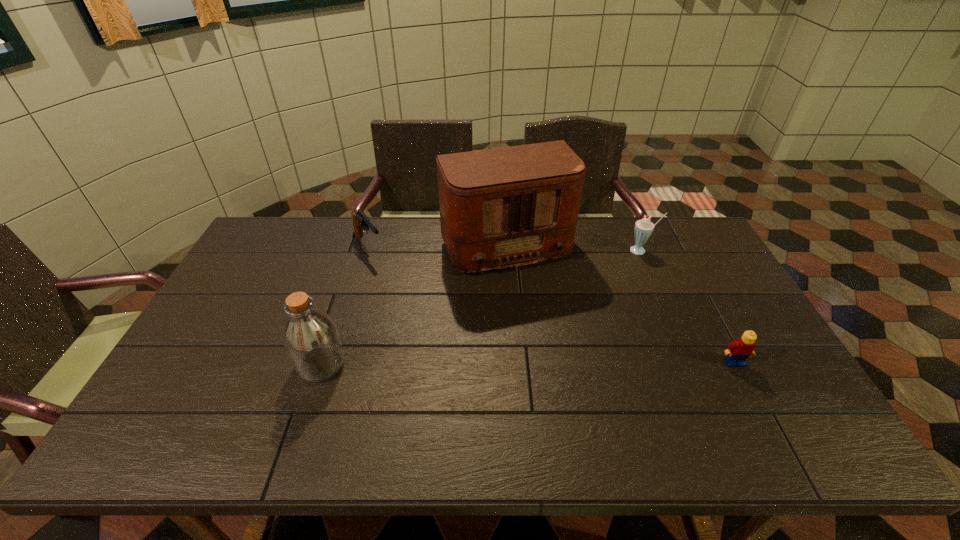
The image size is (960, 540). What are the coordinates of `vacant region located on the front panel of the radio receiver` in the screenshot? It's located at (538, 308).

The image size is (960, 540). Identify the location of vacant space located 0.220m on the front panel of the radio receiver. coord(549,330).

This screenshot has width=960, height=540. I want to click on vacant space located along the barrel of the gun, so click(419, 309).

You are a GUI agent. You are given a task and a screenshot of the screen. Output one action in this format:
    pyautogui.click(x=<x>, y=<y>)
    Task: Click on the free location located along the barrel of the gun
    This screenshot has width=960, height=540.
    Given the screenshot: What is the action you would take?
    [x=415, y=306]

What are the coordinates of `vacant space located along the barrel of the gun` in the screenshot? It's located at (402, 291).

Locate an element on the screen. This screenshot has height=540, width=960. free space located 0.180m on the straw side of the milkshake is located at coordinates (609, 282).

This screenshot has height=540, width=960. Find the location of `free region located 0.270m on the straw side of the milkshake`. free region located 0.270m on the straw side of the milkshake is located at coordinates (594, 297).

Image resolution: width=960 pixels, height=540 pixels. In order to click on vacant space located 0.240m on the straw side of the milkshake in this screenshot , I will do `click(599, 292)`.

This screenshot has width=960, height=540. I want to click on radio receiver situated at the far edge, so click(505, 207).

This screenshot has height=540, width=960. Identify the location of gun that is at the far edge. (360, 221).